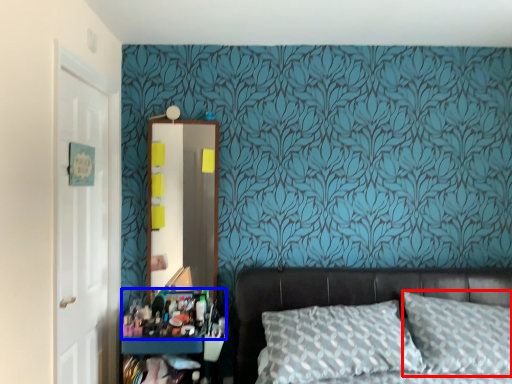
Question: Which object is closer to the camera taking this photo, pillow (highlighted by a red box) or stuff (highlighted by a blue box)?

Choices:
 (A) pillow
 (B) stuff

Answer: (A)